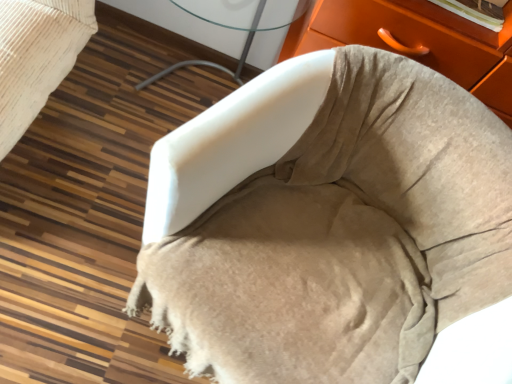
Question: Do you think white glass table at center is within beige suede chair at center, or outside of it?

Choices:
 (A) outside
 (B) inside

Answer: (A)

Question: Considering the positions of point (131, 6) and point (355, 215), is point (131, 6) closer or farther from the camera than point (355, 215)?

Choices:
 (A) farther
 (B) closer

Answer: (A)

Question: From the image's perspective, is white glass table at center positioned above or below beige suede chair at center?

Choices:
 (A) below
 (B) above

Answer: (B)

Question: Considering their positions, is beige suede chair at center located in front of or behind white glass table at center?

Choices:
 (A) behind
 (B) front

Answer: (B)

Question: From a real-world perspective, relative to white glass table at center, is beige suede chair at center vertically above or below?

Choices:
 (A) above
 (B) below

Answer: (A)

Question: Choose the correct answer: Is beige suede chair at center inside white glass table at center or outside it?

Choices:
 (A) outside
 (B) inside

Answer: (A)

Question: Does point (244, 165) appear closer or farther from the camera than point (219, 61)?

Choices:
 (A) farther
 (B) closer

Answer: (B)